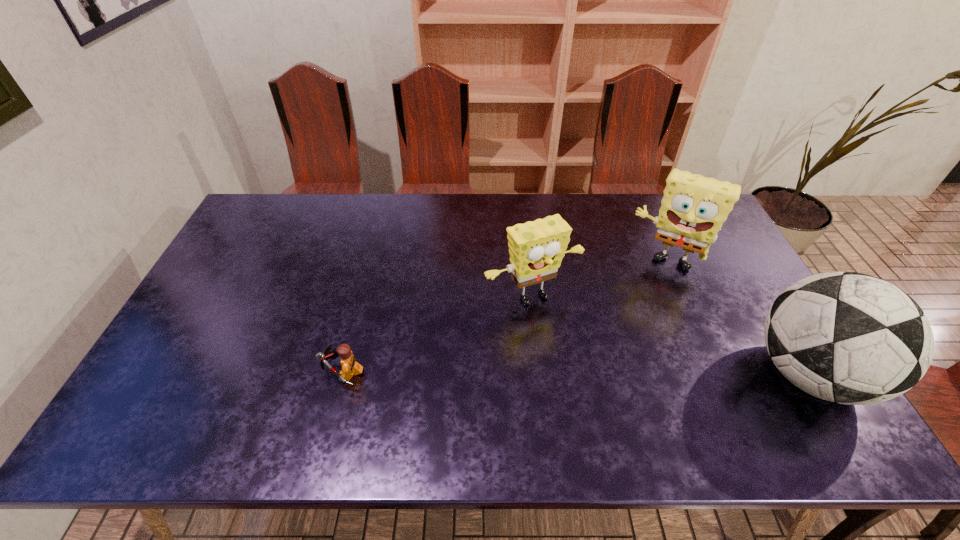
The height and width of the screenshot is (540, 960). I want to click on object present at the near right corner, so click(x=846, y=337).

Find the location of `free space at the far edge of the desktop`. free space at the far edge of the desktop is located at coordinates (520, 206).

Where is `vacant space at the left edge`? This screenshot has height=540, width=960. vacant space at the left edge is located at coordinates (223, 303).

You are a GUI agent. You are given a task and a screenshot of the screen. Output one action in this format:
    pyautogui.click(x=<x>, y=<y>)
    Task: Click on the free space at the right edge of the desktop
    
    Given the screenshot: What is the action you would take?
    pyautogui.click(x=761, y=353)

Identify the location of free space at the near left corner of the desktop. Image resolution: width=960 pixels, height=540 pixels. (176, 387).

Image resolution: width=960 pixels, height=540 pixels. I want to click on vacant space in between the third object from right to left and the shortest object, so click(437, 334).

Where is `free space between the soccer ball and the right sponge`? This screenshot has width=960, height=540. free space between the soccer ball and the right sponge is located at coordinates (736, 317).

What are the coordinates of `free space between the shortest object and the farther sponge` in the screenshot? It's located at point(504,316).

You are a GUI agent. You are given a task and a screenshot of the screen. Output one action in this format:
    pyautogui.click(x=<x>, y=<y>)
    Task: Click on the blank region between the shortest object and the nearer sponge
    Image resolution: width=960 pixels, height=540 pixels.
    Given the screenshot: What is the action you would take?
    pyautogui.click(x=437, y=334)

The height and width of the screenshot is (540, 960). I want to click on blank region between the farther sponge and the third tallest object, so click(598, 279).